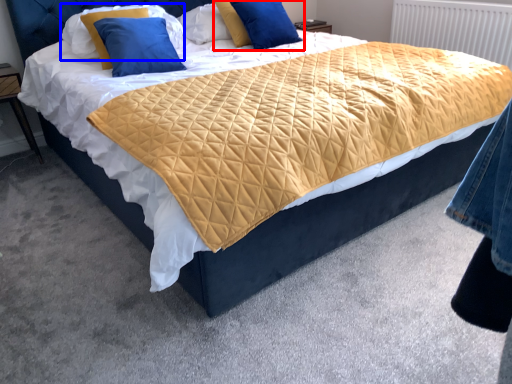
Question: Which of the following is the closest to the observer, pillow (highlighted by a red box) or pillow (highlighted by a blue box)?

Choices:
 (A) pillow
 (B) pillow

Answer: (B)